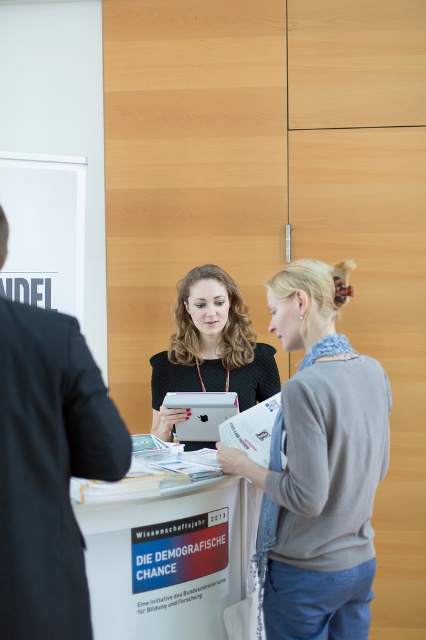
Can you confirm if gray sweater at center is positioned to the left of white cardboard sign at center?

Incorrect, gray sweater at center is not on the left side of white cardboard sign at center.

Between point (273, 525) and point (201, 490), which one is positioned behind?

Point (201, 490)

Locate an element on the screen. This screenshot has width=426, height=640. gray sweater at center is located at coordinates (319, 465).

Does gray sweater at center have a greater height compared to black suit at left?

Correct, gray sweater at center is much taller as black suit at left.

In the scene shown: Can you confirm if gray sweater at center is positioned to the right of black suit at left?

Yes, gray sweater at center is to the right of black suit at left.

Image resolution: width=426 pixels, height=640 pixels. Find the location of `gray sweater at center`. gray sweater at center is located at coordinates coord(319,465).

Does point (25, 502) lie in front of point (229, 349)?

Yes, it is in front of point (229, 349).

Can you confirm if black suit at left is positioned to the right of matte black tablet at center?

No, black suit at left is not to the right of matte black tablet at center.

Which is in front, point (48, 403) or point (230, 301)?

Point (48, 403) is more forward.

Identify the location of black suit at left. The height and width of the screenshot is (640, 426). (48, 468).